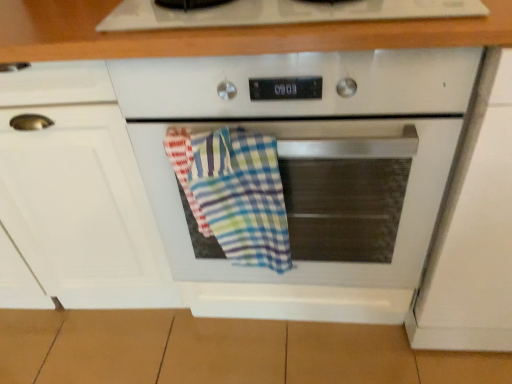
Question: From a real-world perspective, is multicolored checkered towel at center physically above white matte cabinet at left, which is counted as the second cabinetry, starting from the right?

Choices:
 (A) no
 (B) yes

Answer: (B)

Question: Can you confirm if multicolored checkered towel at center is taller than white matte cabinet at left, marked as the 1th cabinetry in a left-to-right arrangement?

Choices:
 (A) no
 (B) yes

Answer: (A)

Question: Is multicolored checkered towel at center facing towards white matte cabinet at left, marked as the 1th cabinetry in a left-to-right arrangement?

Choices:
 (A) no
 (B) yes

Answer: (A)

Question: Considering the relative sizes of multicolored checkered towel at center and white matte cabinet at left, which is counted as the second cabinetry, starting from the right, in the image provided, is multicolored checkered towel at center thinner than white matte cabinet at left, which is counted as the second cabinetry, starting from the right,?

Choices:
 (A) no
 (B) yes

Answer: (B)

Question: Is multicolored checkered towel at center shorter than white matte cabinet at left, which is counted as the second cabinetry, starting from the right?

Choices:
 (A) yes
 (B) no

Answer: (A)

Question: Considering the positions of white glossy oven at center and white matte cabinet at left, which is counted as the second cabinetry, starting from the right, in the image, is white glossy oven at center bigger or smaller than white matte cabinet at left, which is counted as the second cabinetry, starting from the right,?

Choices:
 (A) big
 (B) small

Answer: (B)

Question: Considering the relative positions of white glossy oven at center and white matte cabinet at left, marked as the 1th cabinetry in a left-to-right arrangement, in the image provided, is white glossy oven at center to the left or to the right of white matte cabinet at left, marked as the 1th cabinetry in a left-to-right arrangement,?

Choices:
 (A) right
 (B) left

Answer: (A)

Question: Is white glossy oven at center inside the boundaries of white matte cabinet at left, which is counted as the second cabinetry, starting from the right, or outside?

Choices:
 (A) inside
 (B) outside

Answer: (B)

Question: Considering their positions, is white glossy oven at center located in front of or behind white matte cabinet at left, which is counted as the second cabinetry, starting from the right?

Choices:
 (A) front
 (B) behind

Answer: (A)

Question: Considering the relative positions of white matte cabinet at right, which is counted as the 2th cabinetry, starting from the left, and white matte cabinet at left, marked as the 1th cabinetry in a left-to-right arrangement, in the image provided, is white matte cabinet at right, which is counted as the 2th cabinetry, starting from the left, to the left or to the right of white matte cabinet at left, marked as the 1th cabinetry in a left-to-right arrangement,?

Choices:
 (A) left
 (B) right

Answer: (B)

Question: In terms of height, does white matte cabinet at right, the 1th cabinetry from the right, look taller or shorter compared to white matte cabinet at left, marked as the 1th cabinetry in a left-to-right arrangement?

Choices:
 (A) short
 (B) tall

Answer: (A)

Question: From the image's perspective, is white matte cabinet at right, the 1th cabinetry from the right, positioned above or below white matte cabinet at left, which is counted as the second cabinetry, starting from the right?

Choices:
 (A) below
 (B) above

Answer: (A)

Question: Looking at the image, does white matte cabinet at right, the 1th cabinetry from the right, seem bigger or smaller compared to white matte cabinet at left, marked as the 1th cabinetry in a left-to-right arrangement?

Choices:
 (A) small
 (B) big

Answer: (A)

Question: Considering the positions of white glossy oven at center and white matte cabinet at right, which is counted as the 2th cabinetry, starting from the left, in the image, is white glossy oven at center bigger or smaller than white matte cabinet at right, which is counted as the 2th cabinetry, starting from the left,?

Choices:
 (A) small
 (B) big

Answer: (B)

Question: Would you say white glossy oven at center is inside or outside white matte cabinet at right, which is counted as the 2th cabinetry, starting from the left?

Choices:
 (A) inside
 (B) outside

Answer: (B)